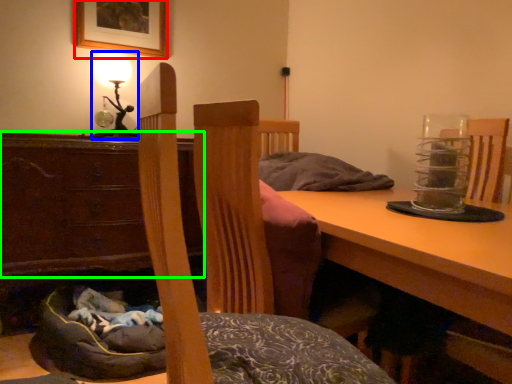
Question: Considering the real-world distances, which object is closest to picture frame (highlighted by a red box)? table lamp (highlighted by a blue box) or cabinetry (highlighted by a green box).

Choices:
 (A) table lamp
 (B) cabinetry

Answer: (A)